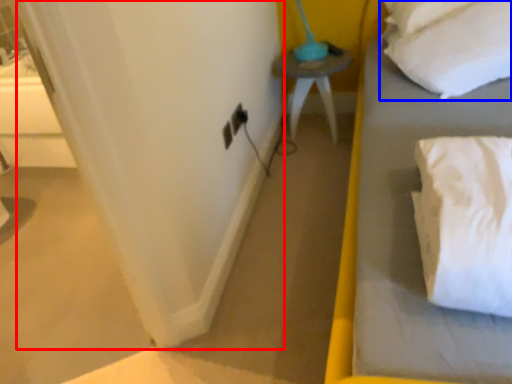
Question: Which point is further to the camera, curtain (highlighted by a red box) or pillow (highlighted by a blue box)?

Choices:
 (A) curtain
 (B) pillow

Answer: (B)